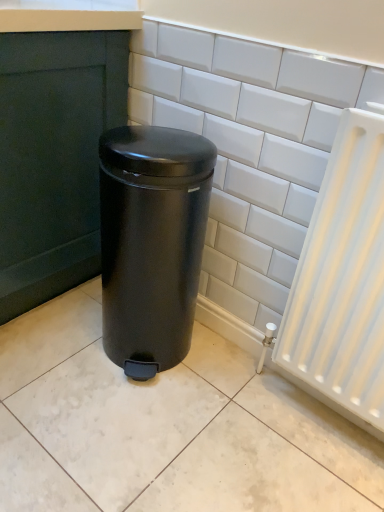
Where is `free space to the right of matte black trash can at center`? This screenshot has width=384, height=512. free space to the right of matte black trash can at center is located at coordinates (234, 384).